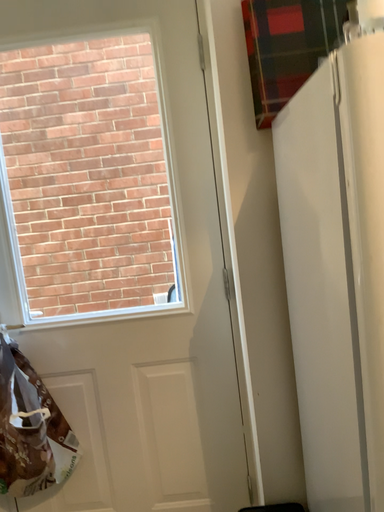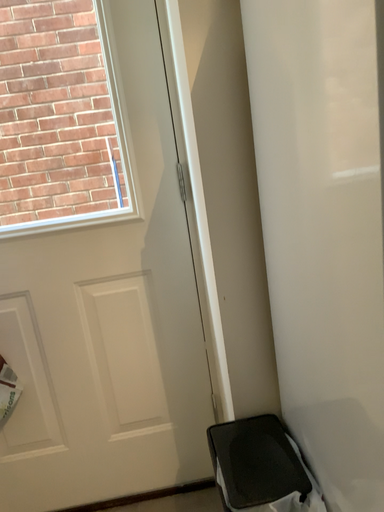
Question: How did the camera likely rotate when shooting the video?

Choices:
 (A) rotated upward
 (B) rotated downward

Answer: (B)